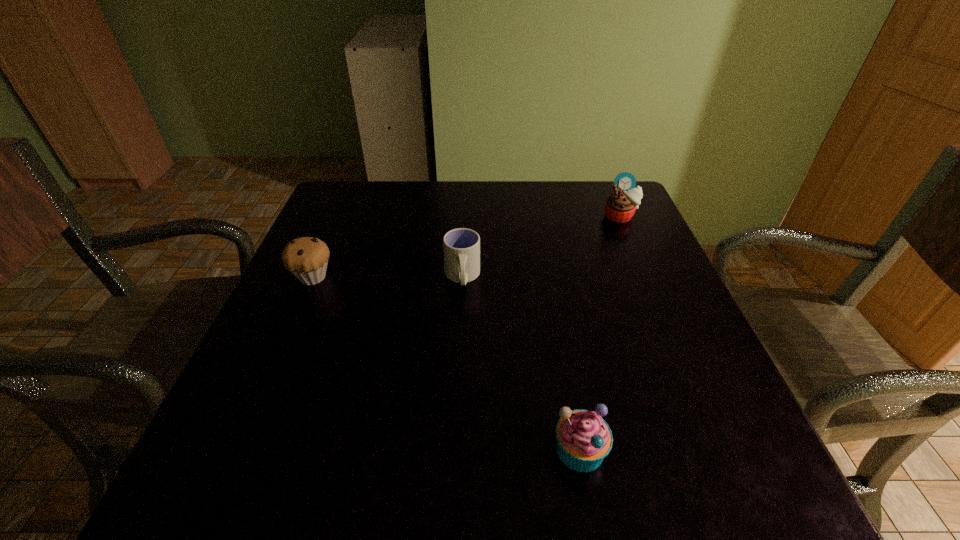
Locate which object is the second closest to the second farthest muffin. Please provide its 2D coordinates. Your answer should be formatted as a tuple, i.e. [(x, y)], where the tuple contains the x and y coordinates of a point satisfying the conditions above.

[(583, 438)]

Point out which muffin is positioned as the second nearest to the farthest object. Please provide its 2D coordinates. Your answer should be formatted as a tuple, i.e. [(x, y)], where the tuple contains the x and y coordinates of a point satisfying the conditions above.

[(306, 258)]

Locate an element on the screen. This screenshot has width=960, height=540. the second closest muffin to the tallest muffin is located at coordinates (306, 258).

Locate an element on the screen. vacant position in the image that satisfies the following two spatial constraints: 1. on the front side of the second nearest muffin; 2. on the right side of the nearest muffin is located at coordinates (238, 449).

In order to click on vacant point that satisfies the following two spatial constraints: 1. with the handle on the side of the nearest object; 2. on the right side of the second object from left to right in this screenshot , I will do `click(454, 449)`.

Where is `vacant region that satisfies the following two spatial constraints: 1. with the handle on the side of the second muffin from right to left; 2. on the left side of the third object from right to left`? Image resolution: width=960 pixels, height=540 pixels. vacant region that satisfies the following two spatial constraints: 1. with the handle on the side of the second muffin from right to left; 2. on the left side of the third object from right to left is located at coordinates (454, 449).

At what (x,y) coordinates should I click in order to perform the action: click on vacant area that satisfies the following two spatial constraints: 1. with the handle on the side of the cup; 2. on the left side of the second muffin from right to left. Please return your answer as a coordinate pair (x, y). Looking at the image, I should click on (454, 449).